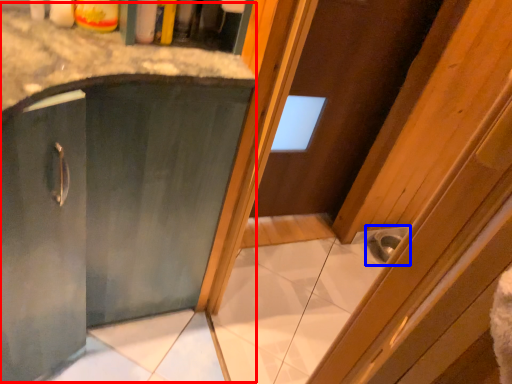
Question: Which of the following is the closest to the observer, cabinetry (highlighted by a red box) or sink (highlighted by a blue box)?

Choices:
 (A) cabinetry
 (B) sink

Answer: (A)